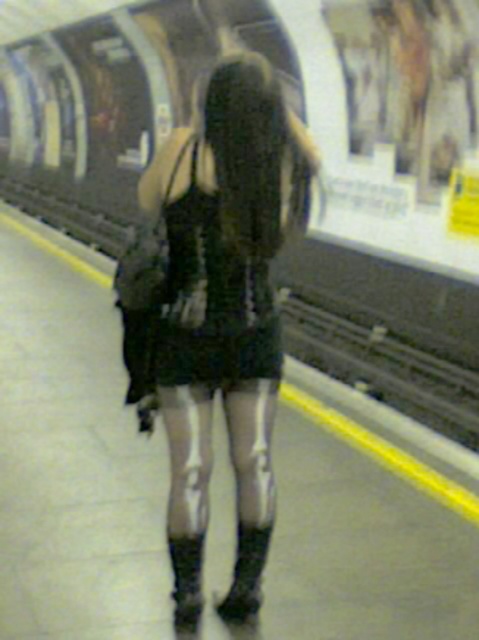
Question: Which object is closer to the camera taking this photo?

Choices:
 (A) metallic gray train at center
 (B) black mesh dress at center
 (C) black matte dress at center
 (D) leather boots at lower center

Answer: (B)

Question: Does black mesh dress at center lie in front of black matte dress at center?

Choices:
 (A) yes
 (B) no

Answer: (A)

Question: Which object is closer to the camera taking this photo?

Choices:
 (A) black mesh dress at center
 (B) leather boots at lower center
 (C) black matte dress at center
 (D) metallic gray train at center

Answer: (A)

Question: Does black mesh dress at center appear under leather boots at lower center?

Choices:
 (A) yes
 (B) no

Answer: (B)

Question: Among these objects, which one is nearest to the camera?

Choices:
 (A) black mesh dress at center
 (B) leather boots at lower center
 (C) black matte dress at center

Answer: (A)

Question: From the image, what is the correct spatial relationship of metallic gray train at center in relation to black matte dress at center?

Choices:
 (A) left
 (B) right

Answer: (A)